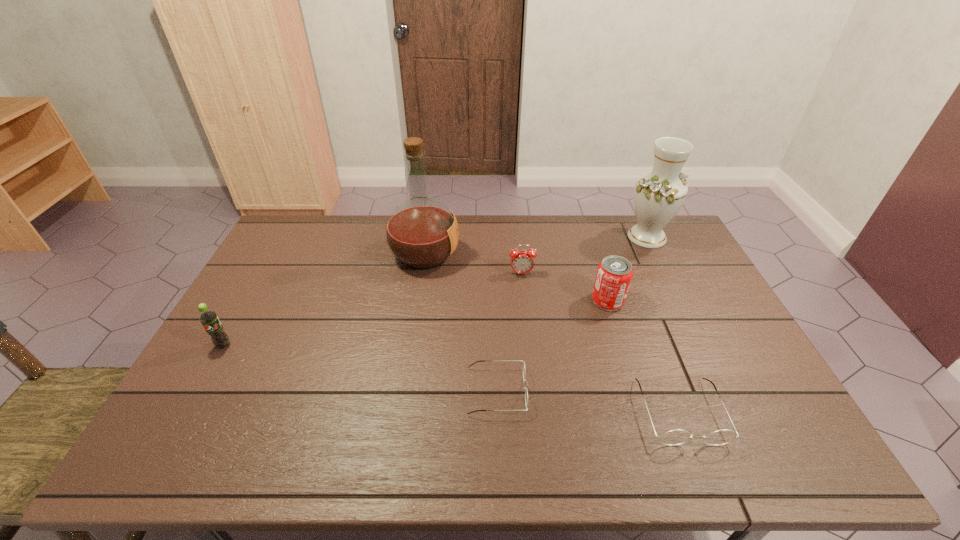
The width and height of the screenshot is (960, 540). I want to click on free space between the leftmost object and the fourth farthest object, so click(416, 323).

Find the location of a particular element. The width and height of the screenshot is (960, 540). vacant point located between the fourth farthest object and the soda is located at coordinates (416, 323).

Find the location of a particular element. vacant space in between the vase and the liquor is located at coordinates (536, 246).

This screenshot has width=960, height=540. In order to click on vacant space in between the fourth farthest object and the alarm clock in this screenshot , I will do `click(564, 287)`.

In order to click on unoccupied position between the vase and the liquor in this screenshot , I will do `click(536, 246)`.

Identify the location of empty space between the shorter spectacles and the vase. The width and height of the screenshot is (960, 540). (572, 314).

Identify which object is the nearest to the shorter spectacles. Please provide its 2D coordinates. Your answer should be formatted as a tuple, i.e. [(x, y)], where the tuple contains the x and y coordinates of a point satisfying the conditions above.

[(676, 437)]

Locate which object is the fourth closest to the third nearest object. Please provide its 2D coordinates. Your answer should be formatted as a tuple, i.e. [(x, y)], where the tuple contains the x and y coordinates of a point satisfying the conditions above.

[(614, 274)]

I want to click on vacant area in the image that satisfies the following two spatial constraints: 1. on the face of the third shortest object; 2. on the right side of the fourth nearest object, so click(524, 301).